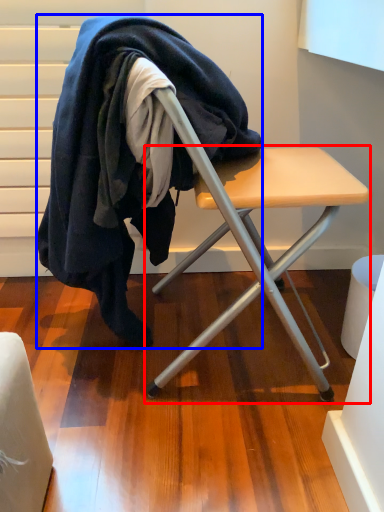
Question: Among these objects, which one is farthest to the camera, table (highlighted by a red box) or wool (highlighted by a blue box)?

Choices:
 (A) table
 (B) wool

Answer: (B)